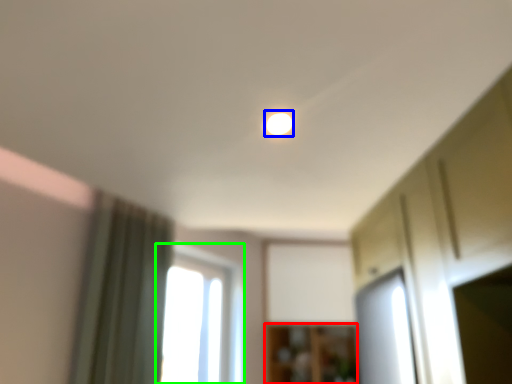
Question: Based on their relative distances, which object is nearer to cabinetry (highlighted by a red box)? Choose from light (highlighted by a blue box) and window (highlighted by a green box).

Choices:
 (A) light
 (B) window

Answer: (B)